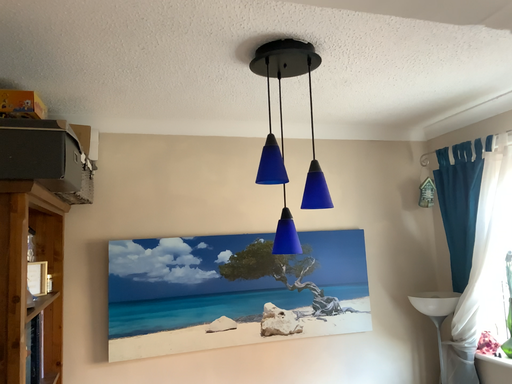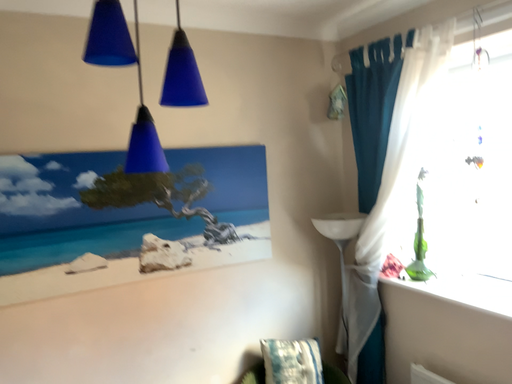
Question: Which way did the camera rotate in the video?

Choices:
 (A) rotated upward
 (B) rotated downward

Answer: (B)